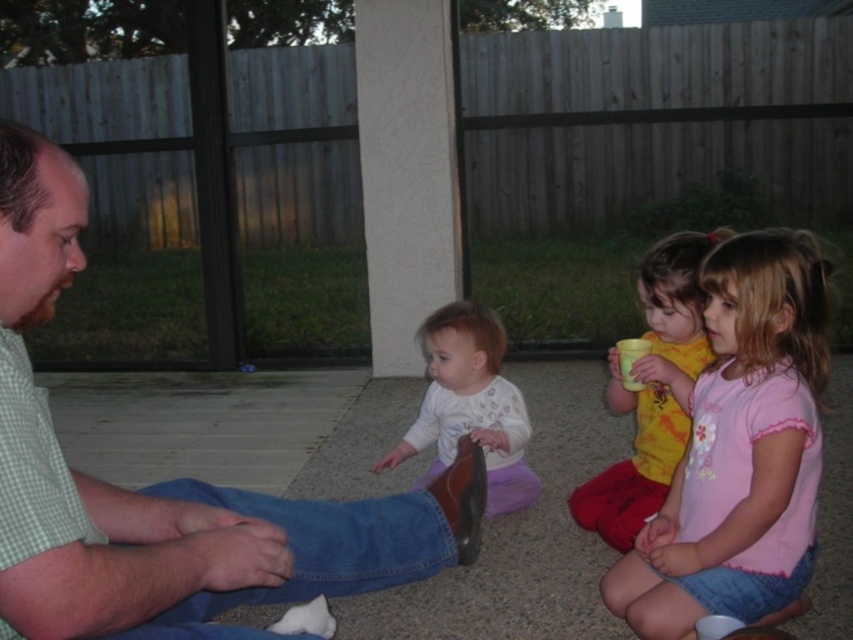
You are a photographer trying to capture a group photo of the green checkered shirt at left and the white soft shirt at center. Since you want both subjects to appear equally sized in the photo, which subject should you move closer to the camera?

The green checkered shirt at left is much taller than the white soft shirt at center. To make them appear the same size in the photo, move the taller subject, the green checkered shirt at left, closer to the camera.

You are a photographer trying to capture a candid shot of the children in the scene. You want to focus on the child wearing the pink cotton shirt at right without including the child in the white soft shirt at center in the frame. Based on their positions, is this possible?

The pink cotton shirt at right is in front of the white soft shirt at center, so yes, you can focus on the child wearing the pink cotton shirt at right without including the child in the white soft shirt at center in the frame by positioning the camera to capture only the front child.